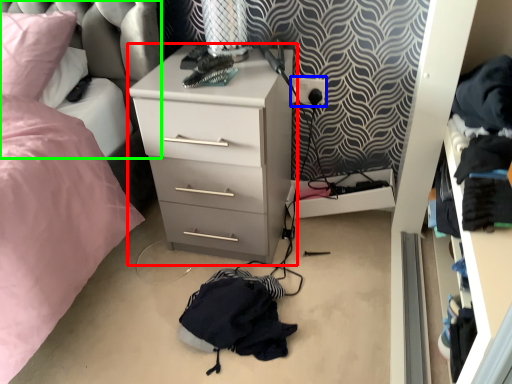
Question: Estimate the real-world distances between objects in this image. Which object is farther from chest of drawers (highlighted by a red box), electric outlet (highlighted by a blue box) or swivel chair (highlighted by a green box)?

Choices:
 (A) electric outlet
 (B) swivel chair

Answer: (A)